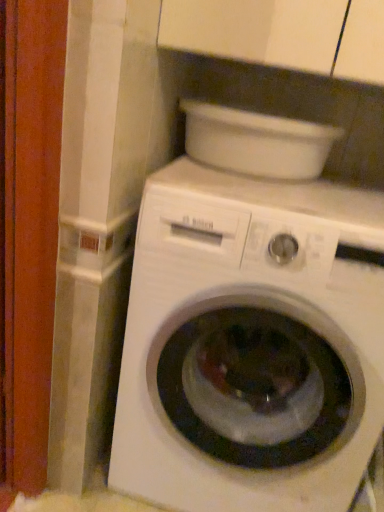
This screenshot has width=384, height=512. Identify the location of white glossy washing machine at center. (254, 336).

The width and height of the screenshot is (384, 512). What do you see at coordinates (254, 336) in the screenshot?
I see `white glossy washing machine at center` at bounding box center [254, 336].

Identify the location of white glossy washing machine at center. Image resolution: width=384 pixels, height=512 pixels. [254, 336].